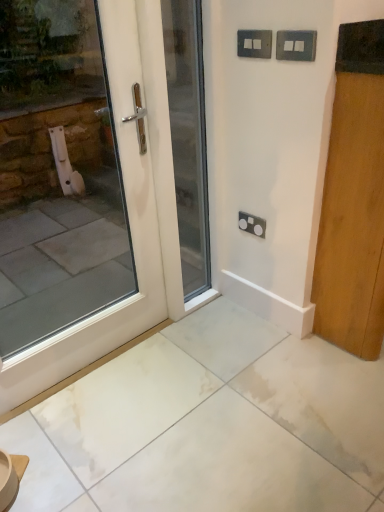
Question: From the image's perspective, is satin black socket at center, which ranks as the third electric outlet in front-to-back order, under wooden door at right, the 3th door viewed from the left?

Choices:
 (A) no
 (B) yes

Answer: (B)

Question: Is satin black socket at center, arranged as the first electric outlet when ordered from the bottom, positioned with its back to wooden door at right, positioned as the 1th door in right-to-left order?

Choices:
 (A) yes
 (B) no

Answer: (B)

Question: Does satin black socket at center, acting as the first electric outlet starting from the back, have a smaller size compared to wooden door at right, positioned as the 1th door in right-to-left order?

Choices:
 (A) no
 (B) yes

Answer: (B)

Question: Can you confirm if satin black socket at center, arranged as the first electric outlet when ordered from the bottom, is shorter than wooden door at right, the 3th door viewed from the left?

Choices:
 (A) yes
 (B) no

Answer: (A)

Question: From a real-world perspective, is satin black socket at center, acting as the first electric outlet starting from the back, on wooden door at right, the 3th door viewed from the left?

Choices:
 (A) yes
 (B) no

Answer: (B)

Question: Looking at their shapes, would you say satin black socket at center, which ranks as the third electric outlet in front-to-back order, is wider or thinner than white glossy door at center, which is the 2th door from right to left?

Choices:
 (A) wide
 (B) thin

Answer: (B)

Question: Is point (243, 220) positioned closer to the camera than point (188, 183)?

Choices:
 (A) farther
 (B) closer

Answer: (B)

Question: Is satin black socket at center, acting as the first electric outlet starting from the back, to the left or to the right of white glossy door at center, which is the 2th door from right to left, in the image?

Choices:
 (A) left
 (B) right

Answer: (B)

Question: In terms of height, does satin black socket at center, acting as the first electric outlet starting from the back, look taller or shorter compared to white glossy door at center, which is the 2th door from right to left?

Choices:
 (A) short
 (B) tall

Answer: (A)

Question: From their relative heights in the image, would you say satin black socket at center, positioned as the 3th electric outlet in top-to-bottom order, is taller or shorter than metallic silver switch at upper center, which is counted as the first electric outlet, starting from the top?

Choices:
 (A) short
 (B) tall

Answer: (B)

Question: From the image's perspective, is satin black socket at center, which ranks as the third electric outlet in front-to-back order, positioned above or below metallic silver switch at upper center, which ranks as the 3th electric outlet in bottom-to-top order?

Choices:
 (A) above
 (B) below

Answer: (B)

Question: Based on their positions, is satin black socket at center, positioned as the 3th electric outlet in top-to-bottom order, located to the left or right of metallic silver switch at upper center, which ranks as the 3th electric outlet in bottom-to-top order?

Choices:
 (A) right
 (B) left

Answer: (A)

Question: Would you say satin black socket at center, which ranks as the third electric outlet in front-to-back order, is inside or outside metallic silver switch at upper center, which ranks as the 3th electric outlet in bottom-to-top order?

Choices:
 (A) inside
 (B) outside

Answer: (B)

Question: From a real-world perspective, is white glossy door at center, which is the 2th door from right to left, positioned above or below white glossy door at left, which is counted as the first door, starting from the left?

Choices:
 (A) above
 (B) below

Answer: (B)

Question: Looking at the image, does white glossy door at center, acting as the second door starting from the left, seem bigger or smaller compared to white glossy door at left, acting as the third door starting from the right?

Choices:
 (A) small
 (B) big

Answer: (A)